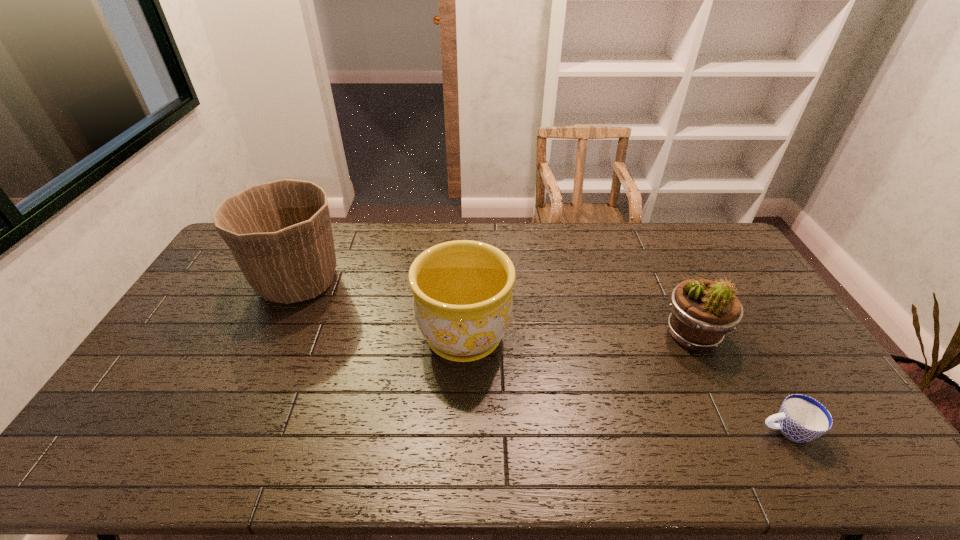
In order to click on the tallest object in this screenshot , I will do click(280, 234).

Locate an element on the screen. This screenshot has width=960, height=540. the tallest flowerpot is located at coordinates (280, 234).

Find the location of a particular element. This screenshot has width=960, height=540. the rightmost flowerpot is located at coordinates (703, 311).

What are the coordinates of `the third object from right to left` in the screenshot? It's located at (462, 290).

Locate an element on the screen. The width and height of the screenshot is (960, 540). the nearest object is located at coordinates (801, 418).

Where is `the shortest object`? The width and height of the screenshot is (960, 540). the shortest object is located at coordinates (801, 418).

Identify the location of vacant space located on the front of the tallest flowerpot. The image size is (960, 540). (231, 427).

Image resolution: width=960 pixels, height=540 pixels. I want to click on vacant space located 0.080m on the front of the rightmost flowerpot, so click(x=715, y=383).

Find the location of `vacant space located 0.120m on the right of the third object from right to left`. vacant space located 0.120m on the right of the third object from right to left is located at coordinates (551, 336).

I want to click on vacant space located 0.090m on the side of the shortest object with the handle, so click(x=724, y=430).